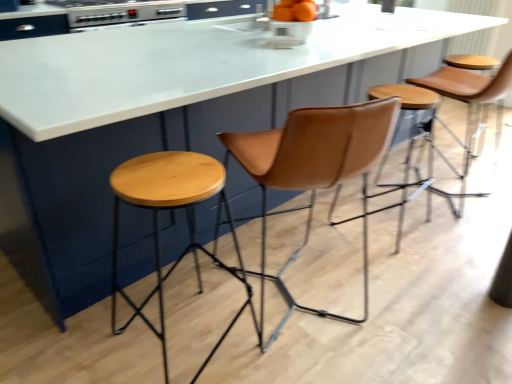
The height and width of the screenshot is (384, 512). Identify the location of free point behind brown leather swivel chair at center. (295, 232).